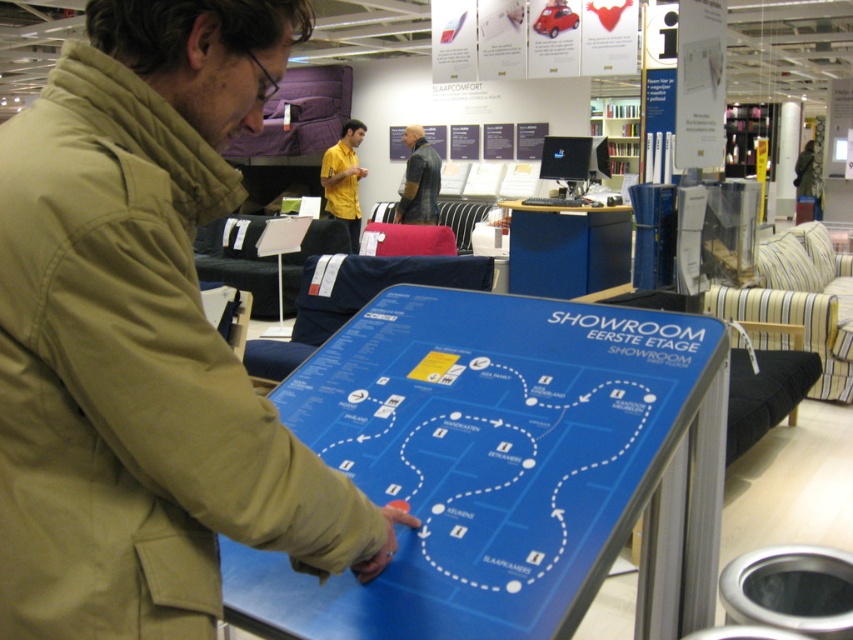
Question: Which object is farther from the camera taking this photo?

Choices:
 (A) leather jacket at center
 (B) khaki cotton trench coat at center

Answer: (A)

Question: Can you confirm if khaki cotton trench coat at center is positioned to the left of blue laminate desk at center?

Choices:
 (A) no
 (B) yes

Answer: (B)

Question: Among these points, which one is nearest to the camera?

Choices:
 (A) (328, 150)
 (B) (172, 116)
 (C) (422, 145)

Answer: (B)

Question: Is khaki cotton trench coat at center bigger than blue glossy map at center?

Choices:
 (A) no
 (B) yes

Answer: (A)

Question: Which object is the farthest from the leather jacket at center?

Choices:
 (A) yellow matte shirt at center
 (B) khaki cotton trench coat at center
 (C) blue glossy map at center
 (D) blue laminate desk at center

Answer: (B)

Question: From the image, what is the correct spatial relationship of blue glossy map at center in relation to leather jacket at center?

Choices:
 (A) above
 (B) below

Answer: (B)